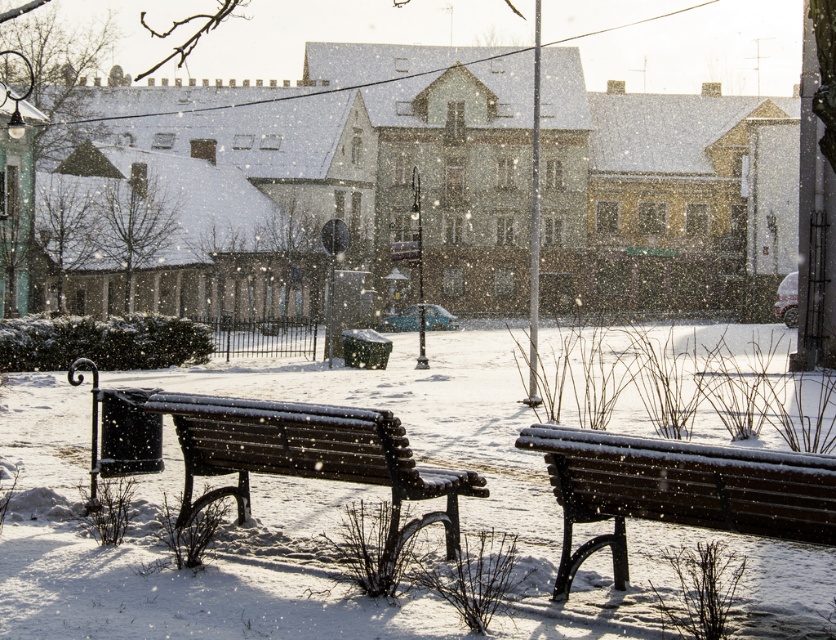
Question: Which of the following is the closest to the observer?

Choices:
 (A) wooden bench at right
 (B) wooden bench at center

Answer: (A)

Question: From the image, what is the correct spatial relationship of wooden bench at right in relation to wooden bench at center?

Choices:
 (A) left
 (B) right

Answer: (B)

Question: Which point is farther to the camera?

Choices:
 (A) wooden bench at center
 (B) wooden bench at right

Answer: (A)

Question: Which point is closer to the camera?

Choices:
 (A) wooden bench at right
 (B) wooden bench at center

Answer: (A)

Question: Is wooden bench at right positioned at the back of wooden bench at center?

Choices:
 (A) no
 (B) yes

Answer: (A)

Question: Can you confirm if wooden bench at right is wider than wooden bench at center?

Choices:
 (A) no
 (B) yes

Answer: (A)